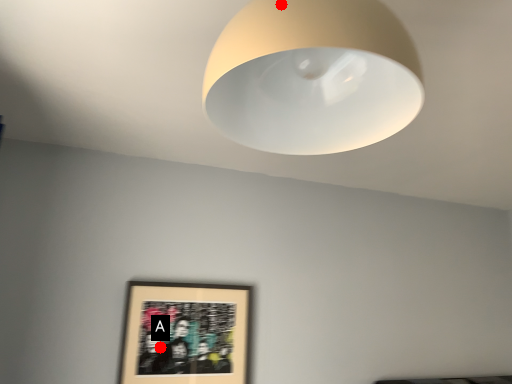
Question: Two points are circled on the image, labeled by A and B beside each circle. Which point is farther from the camera taking this photo?

Choices:
 (A) A is further
 (B) B is further

Answer: (A)